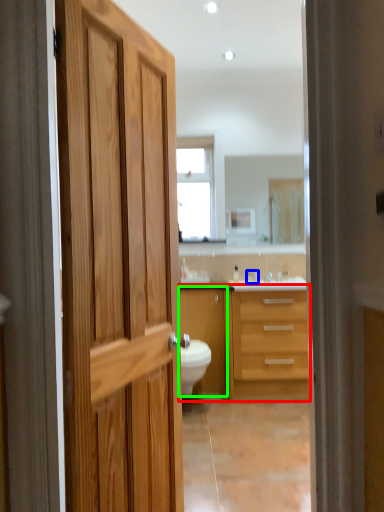
Question: Which object is positioned farthest from bathroom cabinet (highlighted by a red box)? Select from faucet (highlighted by a blue box) and cabinetry (highlighted by a green box).

Choices:
 (A) faucet
 (B) cabinetry

Answer: (A)